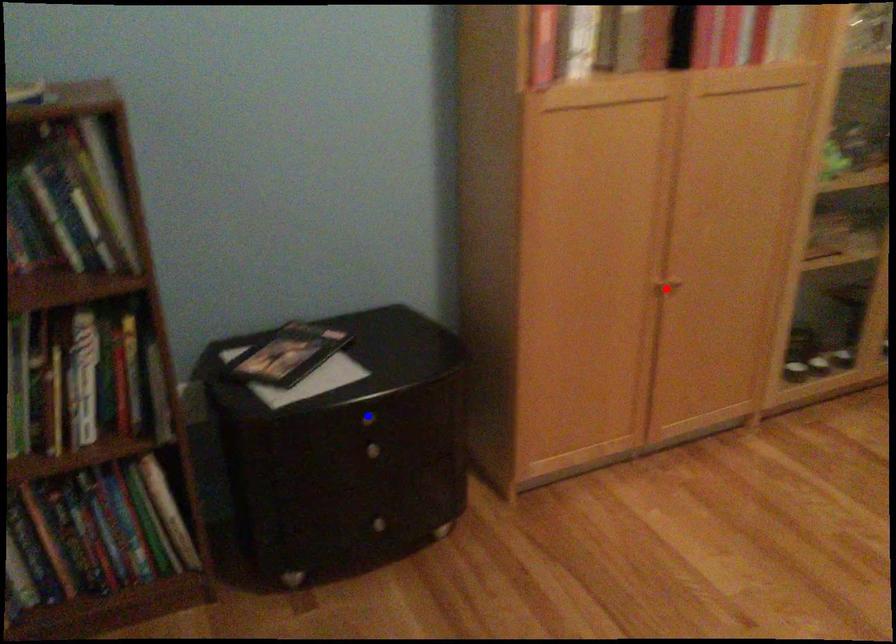
Question: Two points are marked on the image. Which point is closer to the camera?

Choices:
 (A) Blue point is closer.
 (B) Red point is closer.

Answer: (A)